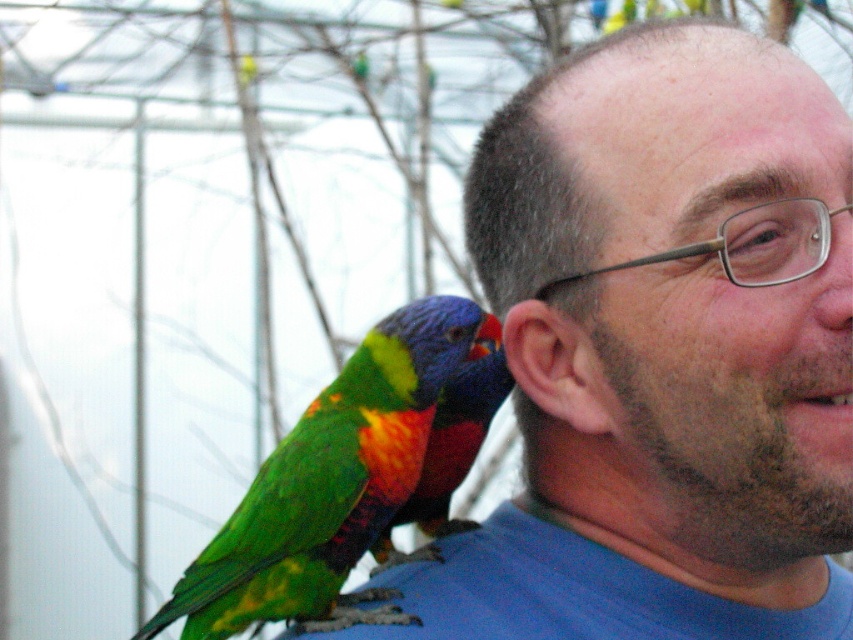
You are a photographer aiming to capture the multicolored feathered parrot at upper left in the center of your photo. Given its current position at point 0.756, 0.390, will you need to adjust your camera to the left or right to frame it properly?

The multicolored feathered parrot at upper left is positioned at point (332, 483). Since the x coordinate 0.756 is closer to the right edge of the image, you should adjust your camera to the right to center it.

You are a photographer trying to capture the man and the colorful bird on his shoulder. The bird is at point (x=332, y=483). Based on the scene description, where exactly is the bird located relative to the man?

The bird is perched on the man shoulder, and the point (x=332, y=483) is on multicolored feathered parrot at upper left, so the bird is located at the upper left part of the man.

You are a photographer trying to capture the multicolored feathered parrot at upper left in focus while the man remains slightly blurred. Given that your camera has a depth of field setting that can focus on objects exactly 40 inches away, will the parrot be in focus?

The multicolored feathered parrot at upper left is 38.01 inches from camera, which is within the camera focus range of 40 inches. Therefore, the parrot will be in focus.